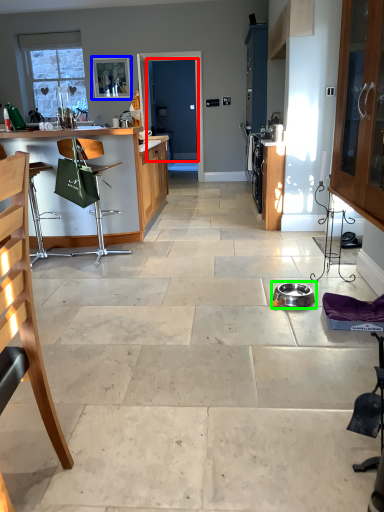
Question: Based on their relative distances, which object is nearer to screen door (highlighted by a red box)? Choose from picture frame (highlighted by a blue box) and appliance (highlighted by a green box).

Choices:
 (A) picture frame
 (B) appliance

Answer: (A)